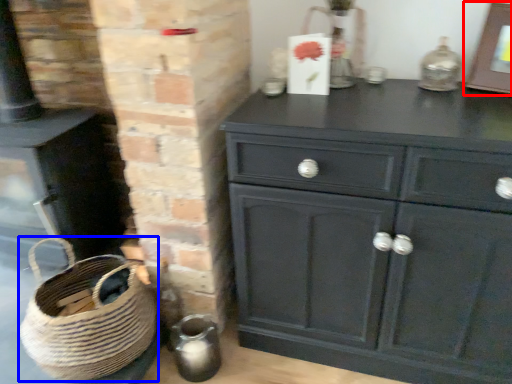
Question: Which object appears closest to the camera in this image, picture frame (highlighted by a red box) or basket (highlighted by a blue box)?

Choices:
 (A) picture frame
 (B) basket

Answer: (A)